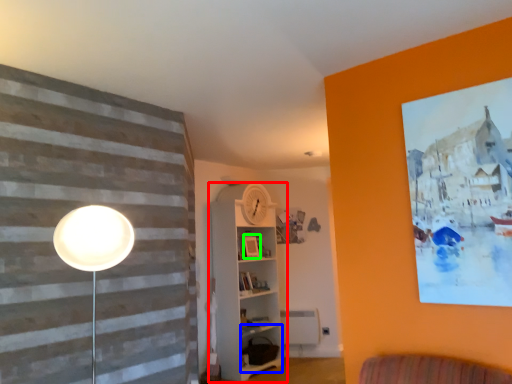
Question: Which is farther away from shelf (highlighted by a red box)? shelf (highlighted by a blue box) or picture frame (highlighted by a green box)?

Choices:
 (A) shelf
 (B) picture frame

Answer: (B)